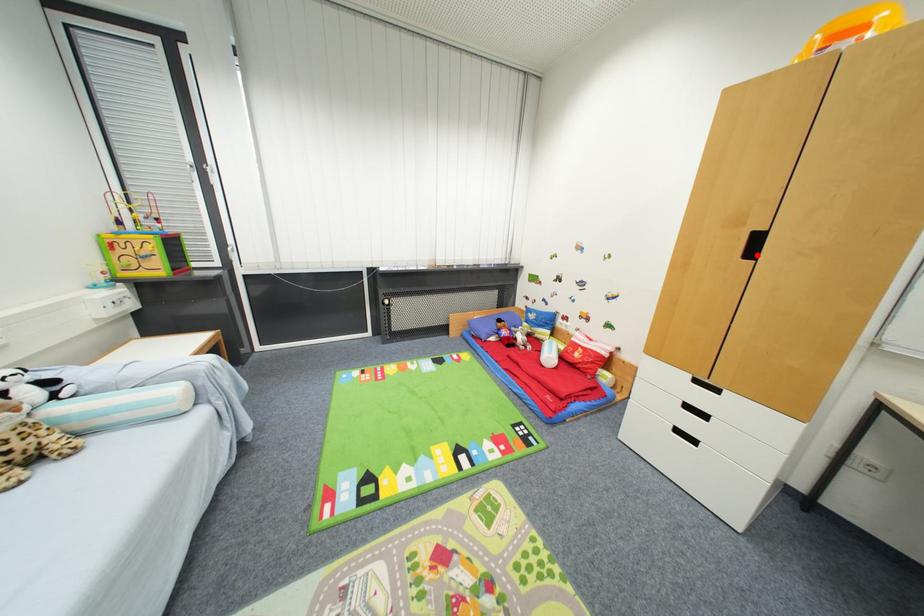
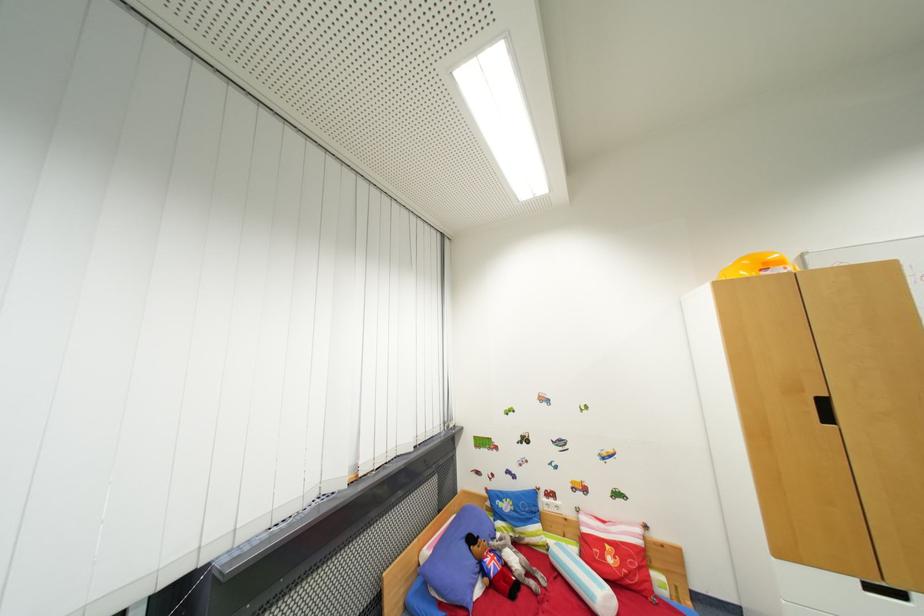
Find the pixel in the second image that matches the highlighted location in the first image.

(833, 419)